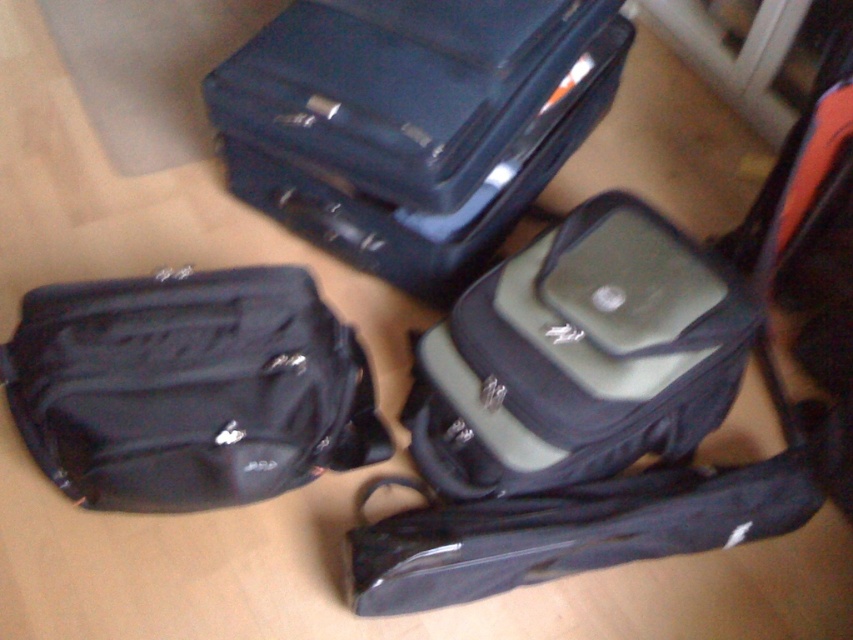
Question: Which object appears farthest from the camera in this image?

Choices:
 (A) black fabric bag at lower left
 (B) matte black suitcase at upper center
 (C) green fabric laptop case at center

Answer: (B)

Question: Which object is the farthest from the matte black suitcase at upper center?

Choices:
 (A) green fabric laptop case at center
 (B) black fabric bag at lower left

Answer: (B)

Question: Estimate the real-world distances between objects in this image. Which object is farther from the green fabric laptop case at center?

Choices:
 (A) matte black suitcase at upper center
 (B) black fabric bag at lower left

Answer: (B)

Question: Does matte black suitcase at upper center appear on the left side of black fabric bag at lower left?

Choices:
 (A) no
 (B) yes

Answer: (A)

Question: Can you confirm if matte black suitcase at upper center is wider than black fabric bag at lower left?

Choices:
 (A) no
 (B) yes

Answer: (B)

Question: Is matte black suitcase at upper center above green fabric laptop case at center?

Choices:
 (A) yes
 (B) no

Answer: (A)